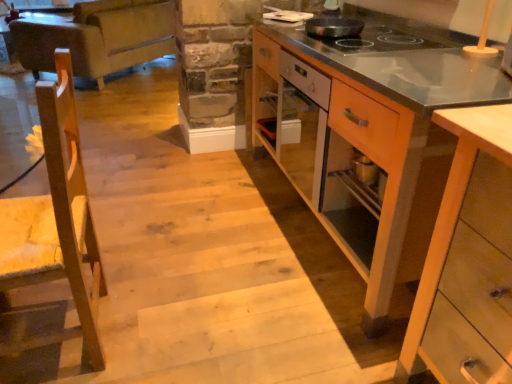
Locate an element on the screen. free space between wooden chair at left and wooden cabinet at right, the first cabinetry viewed from the back is located at coordinates (208, 259).